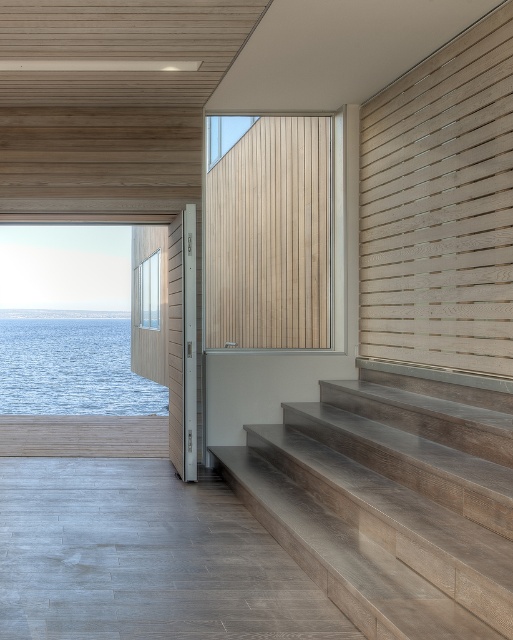
Does wooden textured stairs at lower right lie behind blue water at left?

No, it is in front of blue water at left.

Does point (269, 484) come closer to viewer compared to point (45, 413)?

Yes.

This screenshot has width=513, height=640. What do you see at coordinates (391, 500) in the screenshot?
I see `wooden textured stairs at lower right` at bounding box center [391, 500].

This screenshot has width=513, height=640. I want to click on wooden textured stairs at lower right, so pos(391,500).